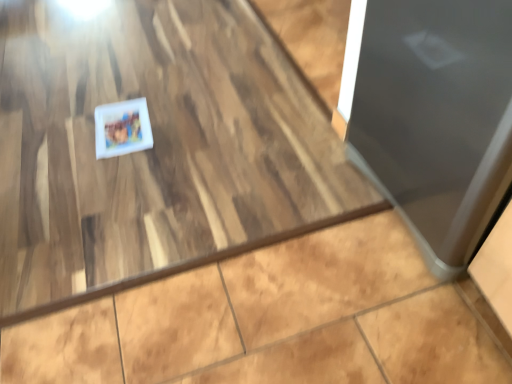
Where is `free space in front of white matte postcard at center`? Image resolution: width=512 pixels, height=384 pixels. free space in front of white matte postcard at center is located at coordinates (110, 172).